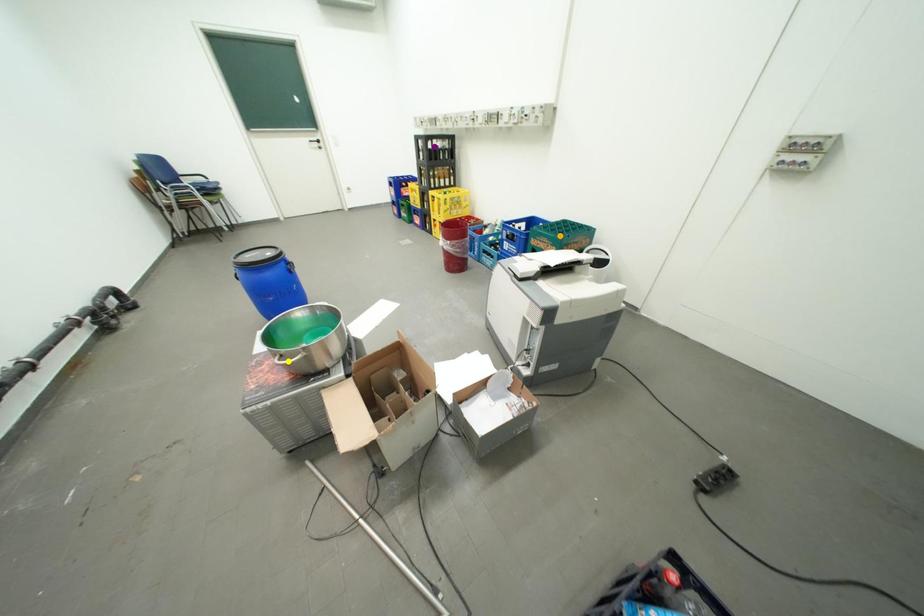
Order these from nearest to farthest:
orange point, yellow point, purple point

yellow point < orange point < purple point